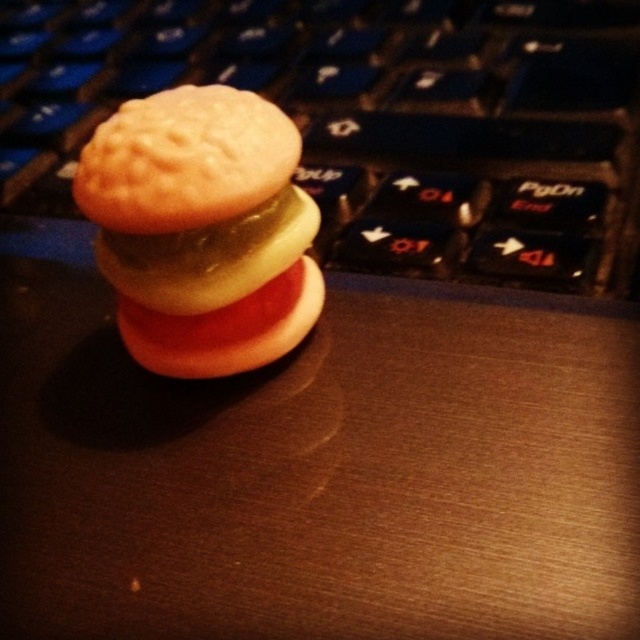
Looking at this image, between black plastic keyboard at center and matte orange biscuit at center, which one is positioned higher?

black plastic keyboard at center is above.

Between point (579, 104) and point (150, 221), which one is positioned in front?

Point (150, 221) is more forward.

Identify the location of black plastic keyboard at center. (372, 120).

Does matte plastic cookie at center appear on the right side of matte orange biscuit at center?

Indeed, matte plastic cookie at center is positioned on the right side of matte orange biscuit at center.

Does point (166, 172) come in front of point (148, 234)?

Yes, point (166, 172) is closer to viewer.

I want to click on matte plastic cookie at center, so click(202, 228).

Locate an element on the screen. matte plastic cookie at center is located at coordinates (202, 228).

Does black plastic keyboard at center appear on the right side of matte plastic cookie at center?

Indeed, black plastic keyboard at center is positioned on the right side of matte plastic cookie at center.

Between point (445, 250) and point (164, 353), which one is positioned in front?

Point (164, 353)

At what (x,y) coordinates should I click in order to perform the action: click on black plastic keyboard at center. Please return your answer as a coordinate pair (x, y). Looking at the image, I should click on (372, 120).